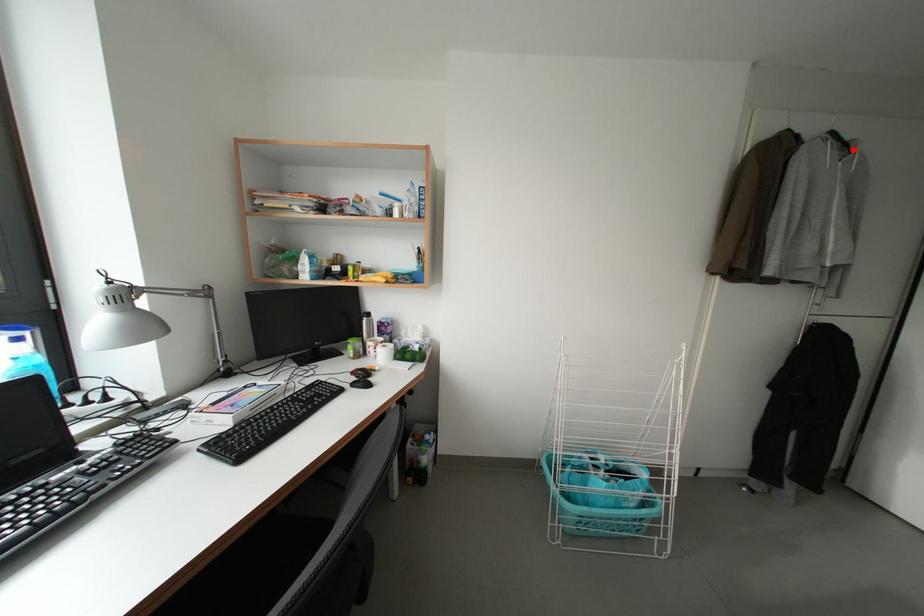
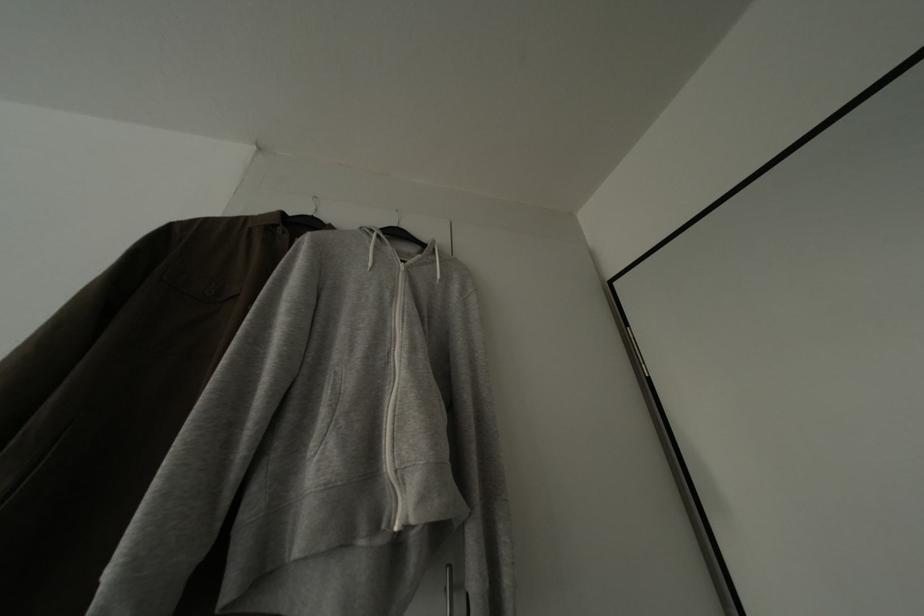
In the second image, find the point that corresponds to the highlighted location in the first image.

(431, 252)